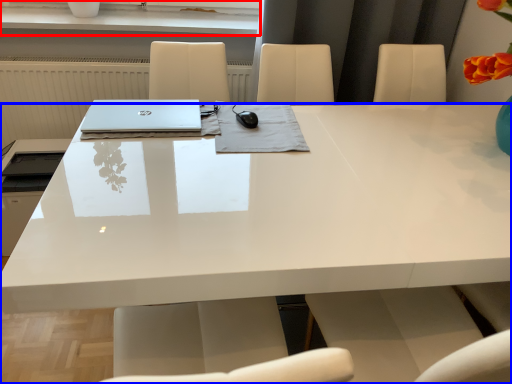
Question: Which point is further to the camera, window sill (highlighted by a red box) or desk (highlighted by a blue box)?

Choices:
 (A) window sill
 (B) desk

Answer: (A)